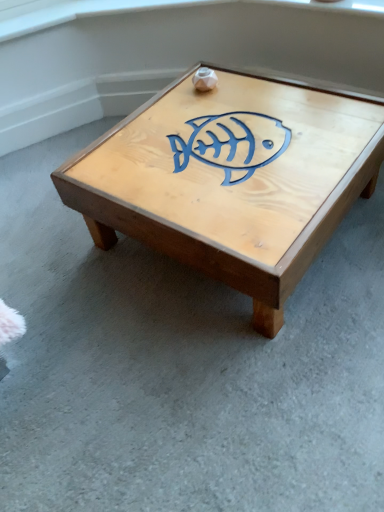
The width and height of the screenshot is (384, 512). In order to click on wooden coffee table at center in this screenshot , I will do `click(231, 180)`.

This screenshot has height=512, width=384. What do you see at coordinates (231, 180) in the screenshot?
I see `wooden coffee table at center` at bounding box center [231, 180].

Measure the distance between wooden coffee table at center and camera.

The distance of wooden coffee table at center from camera is 38.27 inches.

At what (x,y) coordinates should I click in order to perform the action: click on wooden coffee table at center. Please return your answer as a coordinate pair (x, y). Looking at the image, I should click on (x=231, y=180).